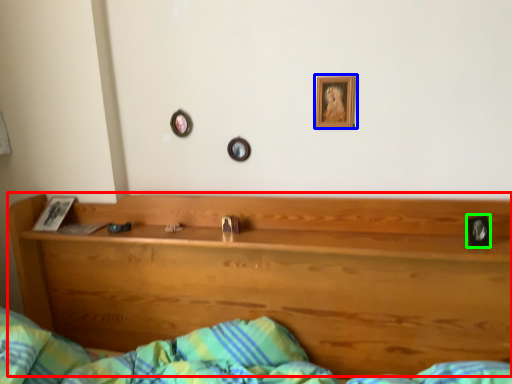
Question: Based on their relative distances, which object is farther from bunk bed (highlighted by a red box)? Choose from picture frame (highlighted by a blue box) and picture frame (highlighted by a green box).

Choices:
 (A) picture frame
 (B) picture frame

Answer: (B)